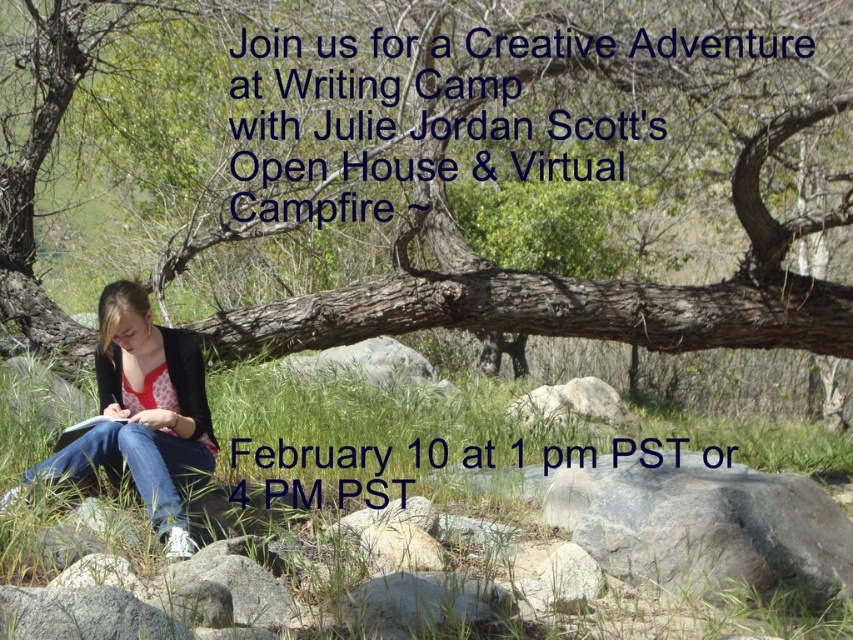
Question: Which point is closer to the camera taking this photo?

Choices:
 (A) (753, 333)
 (B) (630, 467)
 (C) (566, 397)
 (D) (109, 368)

Answer: (D)

Question: Can you confirm if green grass at lower center is wider than gray rock at center?

Choices:
 (A) yes
 (B) no

Answer: (A)

Question: Is green grass at lower center above gray rough rock at lower right?

Choices:
 (A) no
 (B) yes

Answer: (B)

Question: Estimate the real-world distances between objects in this image. Which object is farther from the brown rough tree trunk at center?

Choices:
 (A) green grass at lower center
 (B) gray rock at center
 (C) matte black jacket at lower left

Answer: (C)

Question: Which object is the farthest from the matte black jacket at lower left?

Choices:
 (A) brown rough tree trunk at center
 (B) gray rough rock at lower right
 (C) green grass at lower center

Answer: (A)

Question: Does gray rough rock at lower right have a larger size compared to gray rock at center?

Choices:
 (A) yes
 (B) no

Answer: (B)